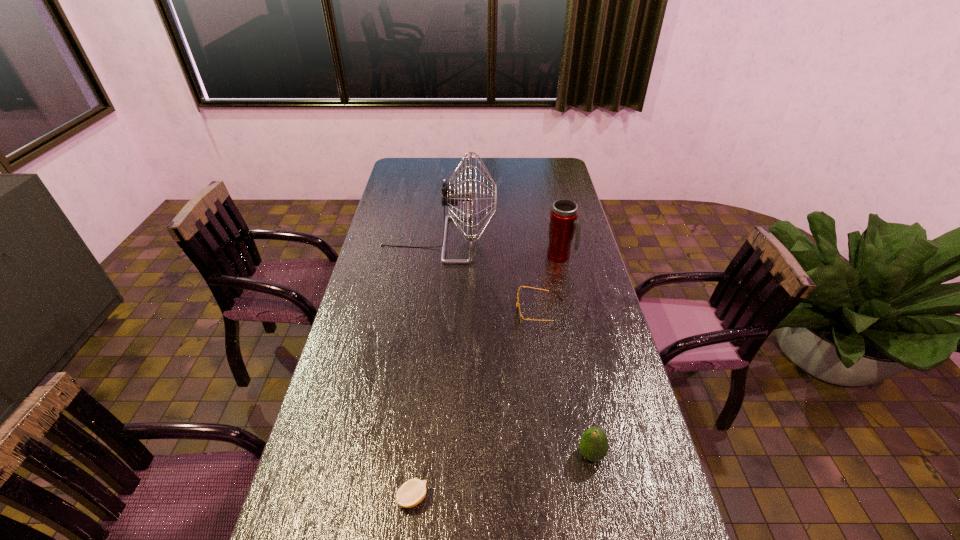
Find the location of `vacant region between the third nearest object and the nearest object`. vacant region between the third nearest object and the nearest object is located at coordinates (476, 405).

What are the coordinates of `free point between the third tallest object and the second tallest object` in the screenshot? It's located at (576, 355).

Locate an element on the screen. This screenshot has height=540, width=960. object that is the closest one to the fourth shortest object is located at coordinates (519, 314).

Select which object appears as the third closest to the third tallest object. Please provide its 2D coordinates. Your answer should be formatted as a tuple, i.e. [(x, y)], where the tuple contains the x and y coordinates of a point satisfying the conditions above.

[(563, 219)]

Find the location of a particular element. This screenshot has width=960, height=540. vacant area that satisfies the following two spatial constraints: 1. on the front-facing side of the tallest object; 2. on the left side of the third tallest object is located at coordinates (413, 454).

Where is `vacant space that satisfies the following two spatial constraints: 1. on the front-facing side of the tallest object; 2. on the right side of the shortest object`? vacant space that satisfies the following two spatial constraints: 1. on the front-facing side of the tallest object; 2. on the right side of the shortest object is located at coordinates (407, 498).

The width and height of the screenshot is (960, 540). Identify the location of free space that satisfies the following two spatial constraints: 1. on the side with the handle of the second tallest object; 2. on the front side of the fourth farthest object. (603, 454).

This screenshot has width=960, height=540. What are the coordinates of `vacant space that satisfies the following two spatial constraints: 1. on the front-facing side of the third nearest object; 2. on the left side of the avocado` in the screenshot? It's located at (561, 454).

At what (x,y) coordinates should I click in order to perform the action: click on vacant space that satisfies the following two spatial constraints: 1. on the front-facing side of the third farthest object; 2. on the right side of the second nearest object. Please return your answer as a coordinate pair (x, y). Looking at the image, I should click on (561, 454).